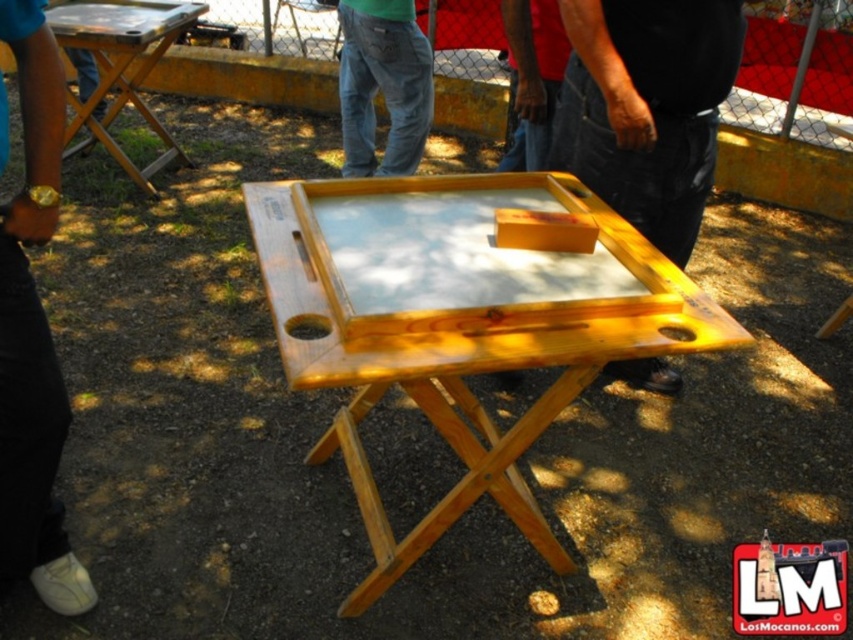
Is denim pants at center wider than black fabric shirt at upper center?

Yes.

Can you confirm if denim pants at center is shorter than black fabric shirt at upper center?

Incorrect, denim pants at center's height does not fall short of black fabric shirt at upper center's.

Is point (354, 19) less distant than point (543, 116)?

No, it is not.

Locate an element on the screen. This screenshot has width=853, height=640. denim pants at center is located at coordinates tap(383, 84).

Between wooden folding table at upper left and black fabric shirt at upper center, which one has more height?

Standing taller between the two is wooden folding table at upper left.

The image size is (853, 640). Describe the element at coordinates (120, 67) in the screenshot. I see `wooden folding table at upper left` at that location.

Measure the distance between wooden folding table at upper left and camera.

wooden folding table at upper left and camera are 3.51 meters apart from each other.

Locate an element on the screen. wooden folding table at upper left is located at coordinates (120, 67).

Can you confirm if denim pants at center is shorter than wooden folding table at upper left?

Correct, denim pants at center is not as tall as wooden folding table at upper left.

Is point (347, 157) closer to viewer compared to point (178, 20)?

Yes, it is in front of point (178, 20).

Is point (357, 10) positioned before point (128, 16)?

That is True.

Where is `denim pants at center`? This screenshot has height=640, width=853. denim pants at center is located at coordinates (383, 84).